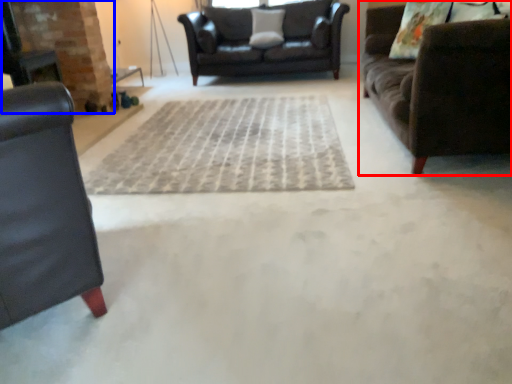
Question: Among these objects, which one is farthest to the camera, studio couch (highlighted by a red box) or fireplace (highlighted by a blue box)?

Choices:
 (A) studio couch
 (B) fireplace

Answer: (B)